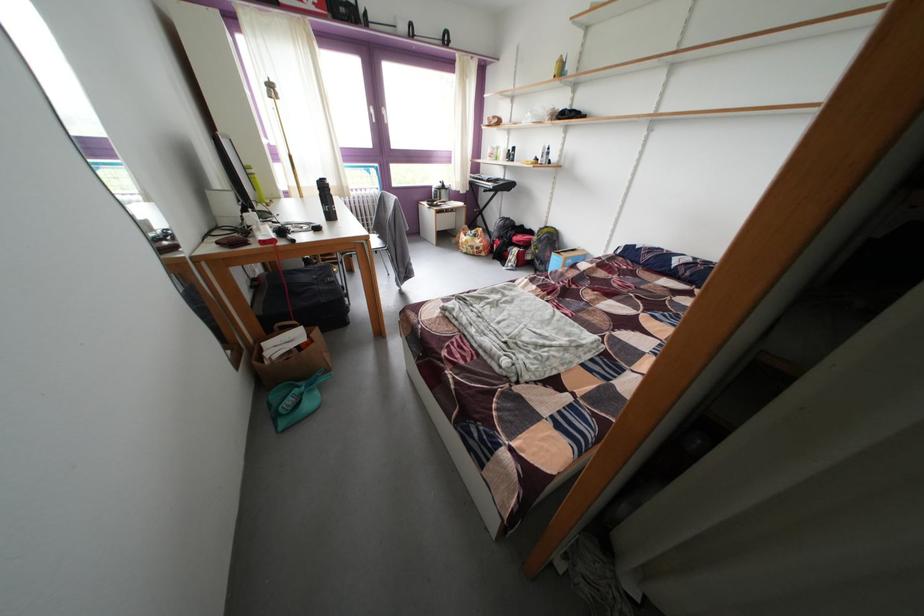
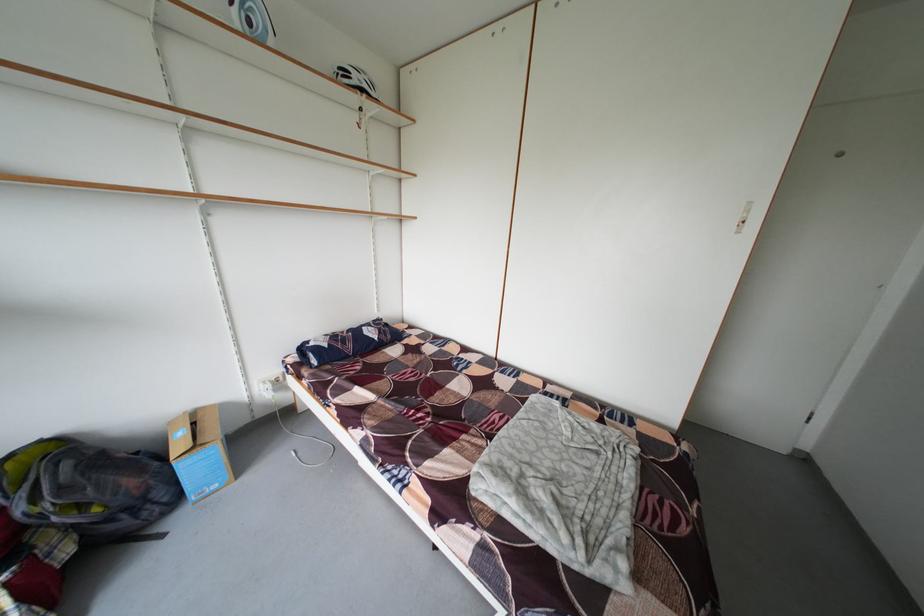
The point at (578, 318) is marked in the first image. Where is the corresponding point in the second image?

(506, 422)